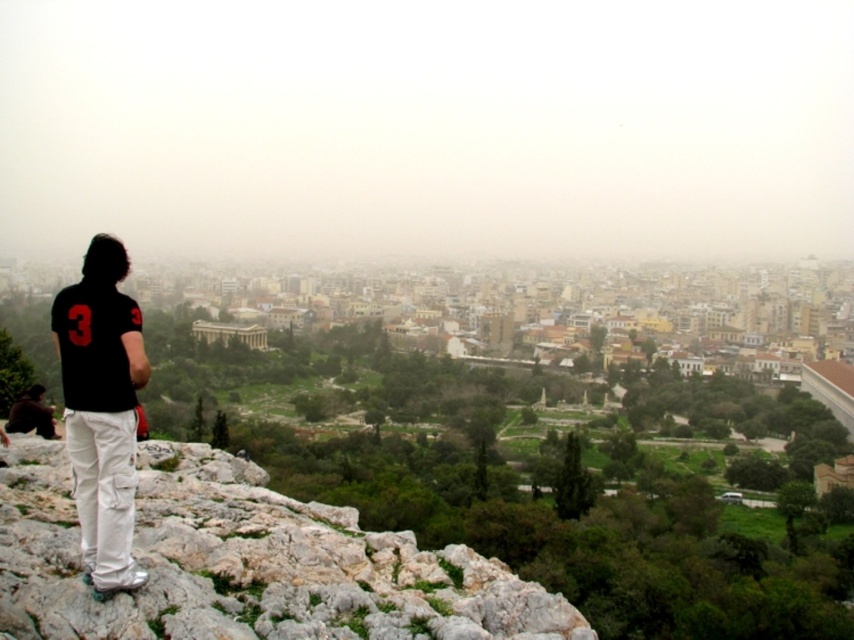
In the scene shown: Can you confirm if black cotton shirt at left is bigger than dark brown leather jacket at lower left?

Indeed, black cotton shirt at left has a larger size compared to dark brown leather jacket at lower left.

You are a GUI agent. You are given a task and a screenshot of the screen. Output one action in this format:
    pyautogui.click(x=<x>, y=<y>)
    Task: Click on the black cotton shirt at left
    
    Given the screenshot: What is the action you would take?
    pyautogui.click(x=101, y=410)

Find the location of `black cotton shirt at left`. black cotton shirt at left is located at coordinates (101, 410).